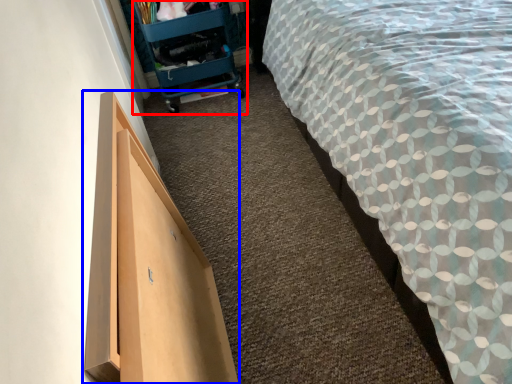
Question: Which point is closer to the camera, trolley (highlighted by a red box) or furniture (highlighted by a blue box)?

Choices:
 (A) trolley
 (B) furniture

Answer: (B)